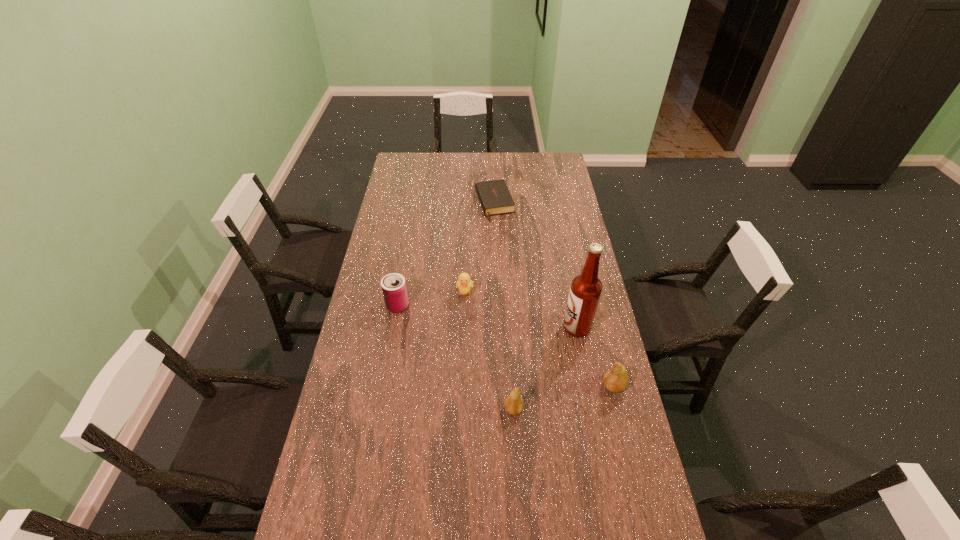
The image size is (960, 540). I want to click on free point that satisfies the following two spatial constraints: 1. on the front-facing side of the duckling; 2. on the left side of the farther pear, so click(462, 386).

The image size is (960, 540). I want to click on free spot that satisfies the following two spatial constraints: 1. on the label side of the alcohol; 2. on the front side of the nearer pear, so click(x=593, y=409).

At what (x,y) coordinates should I click in order to perform the action: click on vacant region that satisfies the following two spatial constraints: 1. on the front side of the right pear; 2. on the right side of the leftmost object. Please return your answer as a coordinate pair (x, y). This screenshot has width=960, height=540. Looking at the image, I should click on (383, 386).

Image resolution: width=960 pixels, height=540 pixels. In order to click on vacant space that satisfies the following two spatial constraints: 1. on the back side of the Bible; 2. on the left side of the leftmost object in this screenshot , I will do `click(416, 204)`.

Locate an element on the screen. This screenshot has height=540, width=960. free location that satisfies the following two spatial constraints: 1. on the front-facing side of the taller pear; 2. on the left side of the second object from left to right is located at coordinates (462, 386).